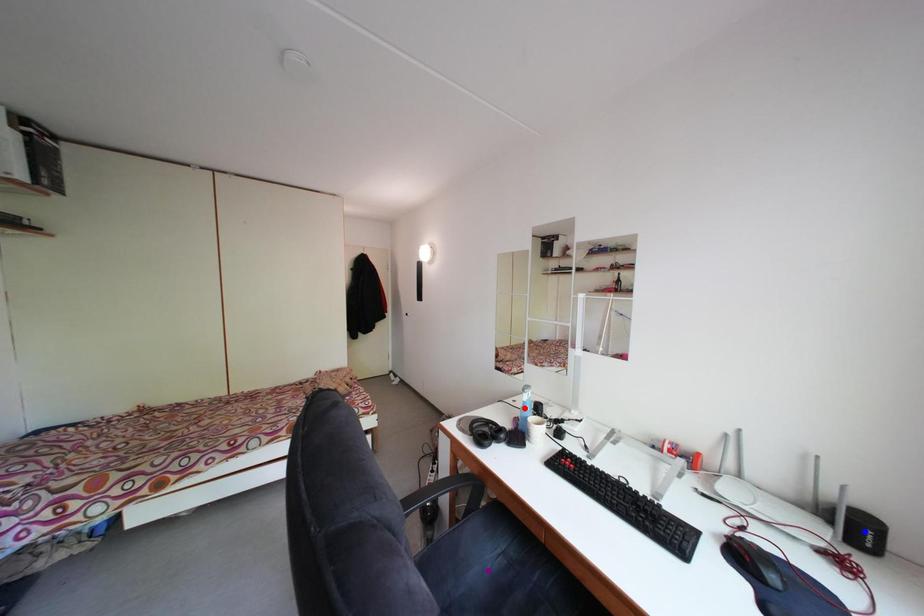
Order these from nearest to farthest:
blue point, red point, purple point

blue point → purple point → red point